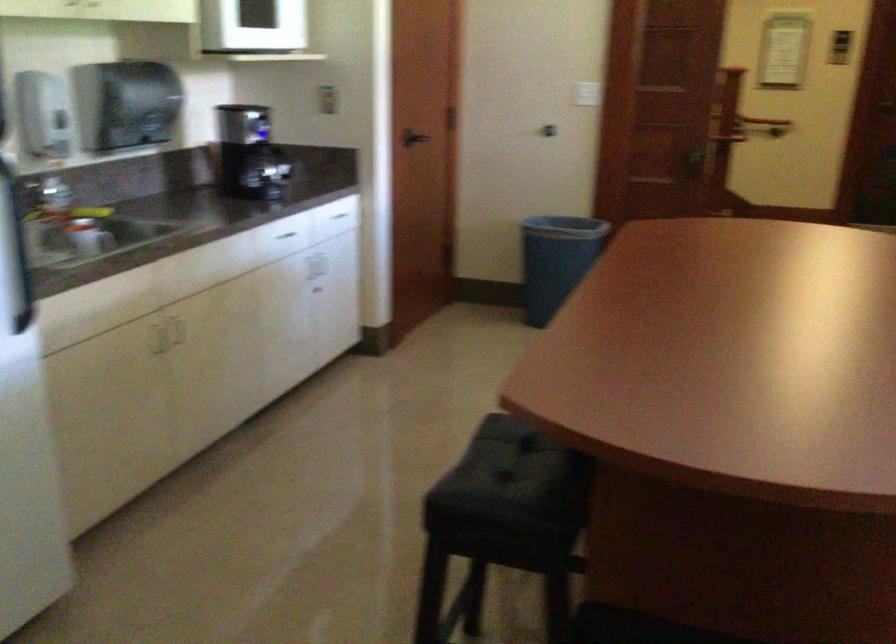
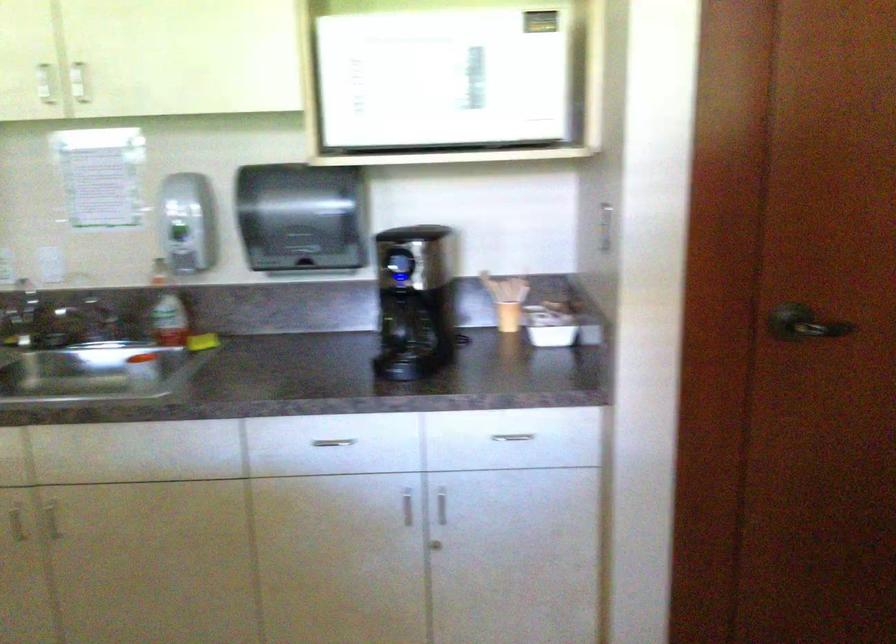
Where in the second image is the point corresponding to (x=170, y=343) from the first image?

(52, 520)